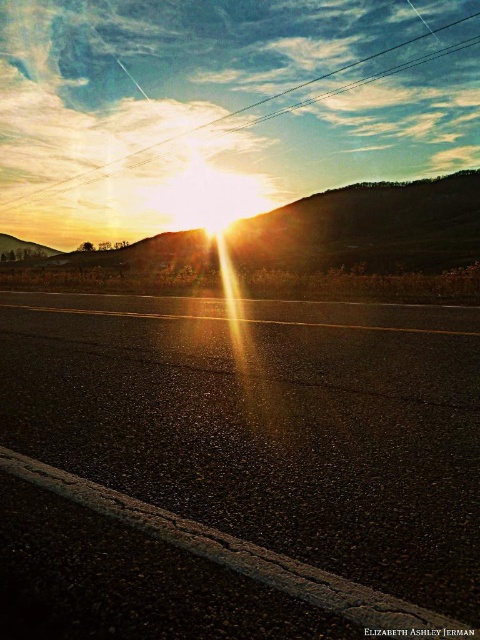
You are standing at the edge of the road and want to walk directly towards the black asphalt highway at center. Given that the coordinates of your current position are at point 0.662, 0.558, can you reach the highway without deviating from your path?

The position of black asphalt highway at center is at point (267, 422), so you are already at the highway. Therefore, you don not need to move further.

You are a photographer aiming to capture the sunset with both the black asphalt highway at center and the metallic wire at upper center in your shot. Based on their positions, which object should you focus on first to ensure both are in frame?

The black asphalt highway at center is located below the metallic wire at upper center, so you should focus on the metallic wire at upper center first to ensure both are in frame.